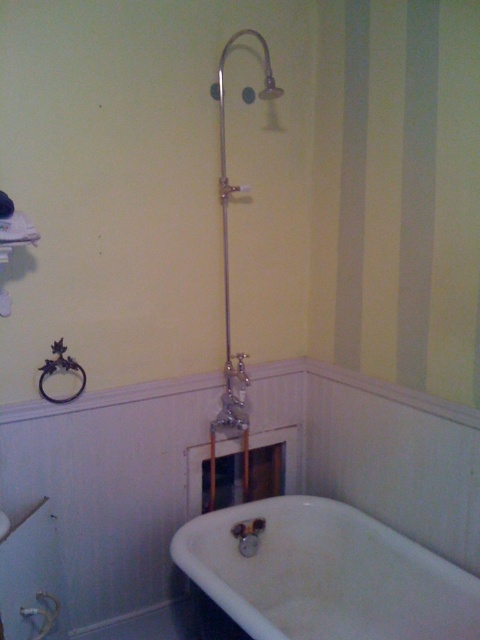
Question: Which of the following is the farthest from the observer?

Choices:
 (A) (224, 422)
 (B) (358, 580)

Answer: (A)

Question: Where is white glossy bathtub at lower center located in relation to polished chrome shower at center in the image?

Choices:
 (A) above
 (B) below

Answer: (B)

Question: Does white glossy bathtub at lower center appear under polished chrome shower at center?

Choices:
 (A) no
 (B) yes

Answer: (B)

Question: Which point is farther from the camera taking this photo?

Choices:
 (A) (x=227, y=342)
 (B) (x=231, y=554)

Answer: (A)

Question: Can you confirm if white glossy bathtub at lower center is positioned to the left of polished chrome shower at center?

Choices:
 (A) yes
 (B) no

Answer: (B)